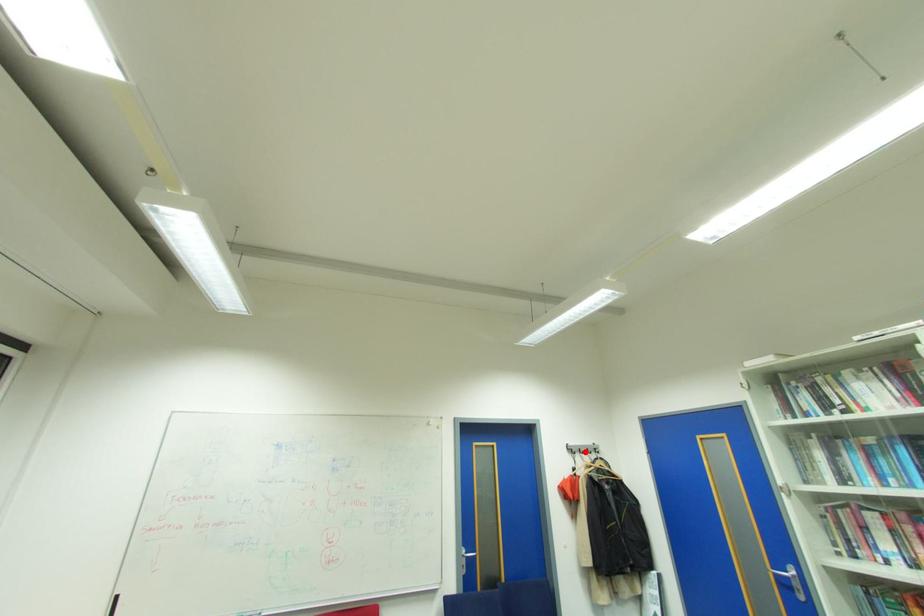
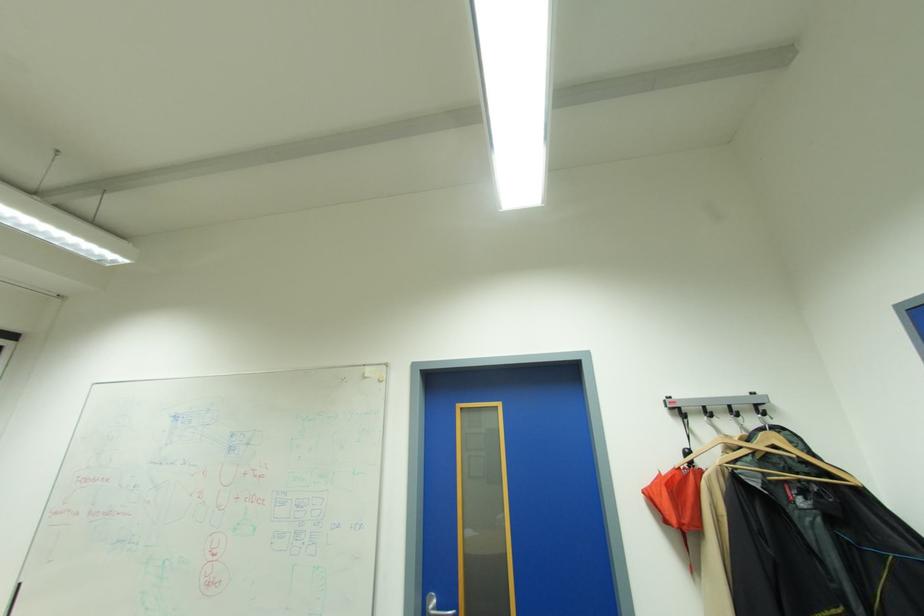
Where in the second image is the point corresponding to the highlighted location from the first image?

(712, 413)